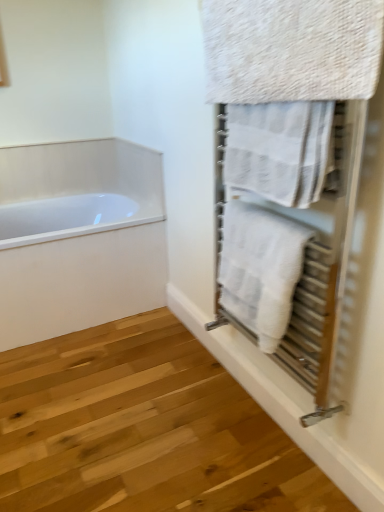
Question: Considering the relative sizes of textured beige towel at upper right, arranged as the 1th towel when viewed from the top, and white textured towel at upper right, acting as the second towel starting from the top, in the image provided, is textured beige towel at upper right, arranged as the 1th towel when viewed from the top, shorter than white textured towel at upper right, acting as the second towel starting from the top,?

Choices:
 (A) no
 (B) yes

Answer: (A)

Question: Can you confirm if textured beige towel at upper right, the third towel from the bottom, is positioned to the left of white textured towel at upper right, acting as the second towel starting from the top?

Choices:
 (A) yes
 (B) no

Answer: (A)

Question: Can you confirm if textured beige towel at upper right, the third towel from the bottom, is bigger than white textured towel at upper right, acting as the second towel starting from the top?

Choices:
 (A) yes
 (B) no

Answer: (A)

Question: Is textured beige towel at upper right, arranged as the 1th towel when viewed from the top, thinner than white textured towel at upper right, acting as the second towel starting from the top?

Choices:
 (A) no
 (B) yes

Answer: (B)

Question: From the image's perspective, would you say textured beige towel at upper right, arranged as the 1th towel when viewed from the top, is shown under white textured towel at upper right, acting as the second towel starting from the top?

Choices:
 (A) yes
 (B) no

Answer: (B)

Question: From the image's perspective, is textured beige towel at upper right, the third towel from the bottom, over white textured towel at upper right, acting as the second towel starting from the top?

Choices:
 (A) yes
 (B) no

Answer: (A)

Question: Is white glossy bathtub at left positioned behind white textured towel at right, the first towel positioned from the bottom?

Choices:
 (A) no
 (B) yes

Answer: (B)

Question: Is white glossy bathtub at left oriented towards white textured towel at right, the first towel positioned from the bottom?

Choices:
 (A) no
 (B) yes

Answer: (B)

Question: Is white glossy bathtub at left far away from white textured towel at right, the first towel positioned from the bottom?

Choices:
 (A) no
 (B) yes

Answer: (B)

Question: Is white glossy bathtub at left at the left side of white textured towel at right, the first towel positioned from the bottom?

Choices:
 (A) no
 (B) yes

Answer: (B)

Question: Can we say white glossy bathtub at left lies outside white textured towel at right, positioned as the third towel in top-to-bottom order?

Choices:
 (A) yes
 (B) no

Answer: (A)

Question: From the image's perspective, is white glossy bathtub at left on white textured towel at right, the first towel positioned from the bottom?

Choices:
 (A) yes
 (B) no

Answer: (A)

Question: Is white textured towel at upper right, arranged as the 2th towel when ordered from the bottom, at the right side of white textured towel at right, the first towel positioned from the bottom?

Choices:
 (A) yes
 (B) no

Answer: (A)